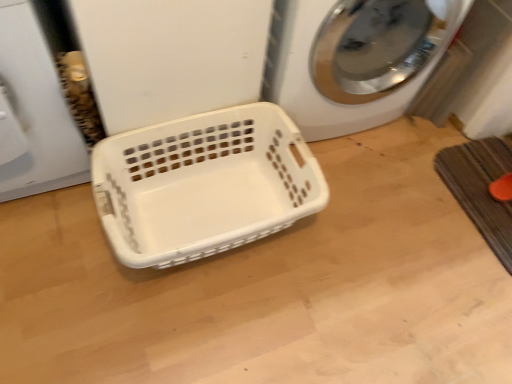
Question: From the image's perspective, would you say brown textured bath mat at lower right is positioned over white plastic washing machine at center?

Choices:
 (A) no
 (B) yes

Answer: (A)

Question: From a real-world perspective, is brown textured bath mat at lower right positioned over white plastic washing machine at center based on gravity?

Choices:
 (A) no
 (B) yes

Answer: (A)

Question: From the image's perspective, is brown textured bath mat at lower right below white plastic washing machine at center?

Choices:
 (A) yes
 (B) no

Answer: (A)

Question: Can you confirm if brown textured bath mat at lower right is taller than white plastic washing machine at center?

Choices:
 (A) no
 (B) yes

Answer: (A)

Question: Does brown textured bath mat at lower right appear on the right side of white plastic washing machine at center?

Choices:
 (A) yes
 (B) no

Answer: (A)

Question: Can you confirm if brown textured bath mat at lower right is shorter than white plastic washing machine at center?

Choices:
 (A) yes
 (B) no

Answer: (A)

Question: From the image's perspective, does white plastic basket at center appear higher than brown textured bath mat at lower right?

Choices:
 (A) yes
 (B) no

Answer: (B)

Question: Considering the relative positions of white plastic basket at center and brown textured bath mat at lower right in the image provided, is white plastic basket at center behind brown textured bath mat at lower right?

Choices:
 (A) yes
 (B) no

Answer: (B)

Question: From a real-world perspective, is white plastic basket at center under brown textured bath mat at lower right?

Choices:
 (A) yes
 (B) no

Answer: (B)

Question: Is white plastic basket at center shorter than brown textured bath mat at lower right?

Choices:
 (A) no
 (B) yes

Answer: (A)

Question: Is white plastic basket at center in front of brown textured bath mat at lower right?

Choices:
 (A) yes
 (B) no

Answer: (A)

Question: Is white plastic basket at center not within brown textured bath mat at lower right?

Choices:
 (A) no
 (B) yes

Answer: (B)

Question: From the image's perspective, is brown textured bath mat at lower right located above white plastic basket at center?

Choices:
 (A) yes
 (B) no

Answer: (A)